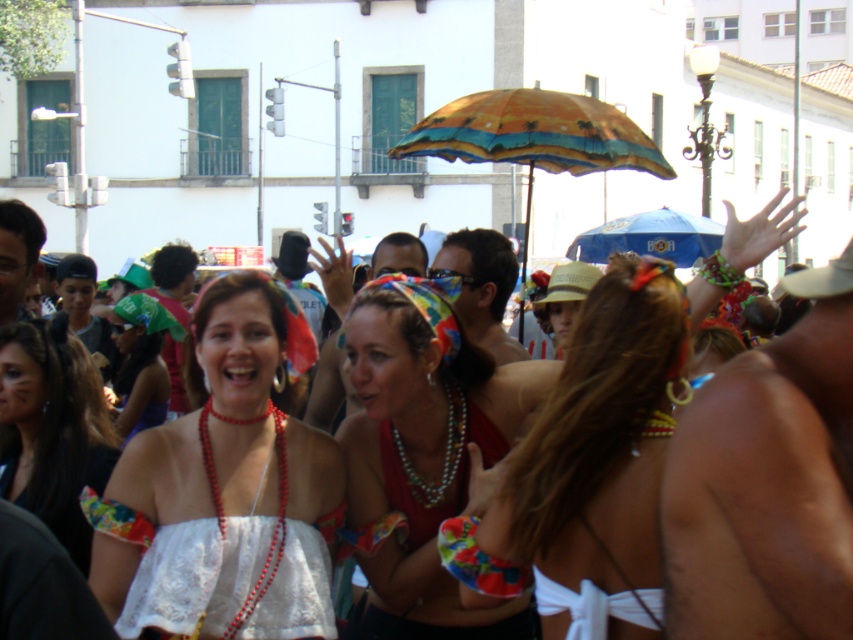
Question: Which object appears closest to the camera in this image?

Choices:
 (A) white lace dress at center
 (B) white lace top at center

Answer: (A)

Question: Is multicolored fabric umbrella at center further to the viewer compared to blue fabric umbrella at upper center?

Choices:
 (A) yes
 (B) no

Answer: (B)

Question: From the image, what is the correct spatial relationship of white lace top at center in relation to multicolored fabric umbrella at center?

Choices:
 (A) right
 (B) left

Answer: (B)

Question: Among these points, which one is nearest to the camera?

Choices:
 (A) (419, 547)
 (B) (41, 422)

Answer: (B)

Question: From the image, what is the correct spatial relationship of white lace top at center in relation to blue fabric umbrella at upper center?

Choices:
 (A) below
 (B) above

Answer: (A)

Question: Estimate the real-world distances between objects in this image. Which object is farther from the white lace dress at center?

Choices:
 (A) white lace bikini top at center
 (B) white fabric bikini at center
 (C) multicolored fabric umbrella at center

Answer: (C)